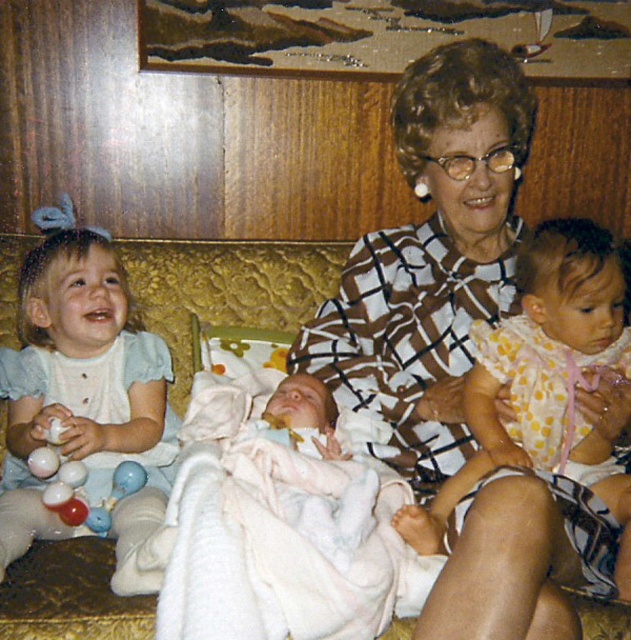
You are standing in the living room and see the light blue fabric dress at left. Can you reach out and touch it without moving your feet?

The light blue fabric dress at left is 3.71 feet away from the viewer, so you cannot reach it without moving your feet since the average human arm span is about 3 feet.

You are a photographer trying to capture a family photo. You notice two dresses in the scene, the light blue fabric dress at left and the yellow polka dot dress at center. Which dress is taller?

The light blue fabric dress at left is taller than the yellow polka dot dress at center.

You are a photographer setting up a camera to capture the scene. You need to ensure that both the light blue fabric dress at left and the yellow polka dot dress at center are in focus. The camera you are using has a depth of field that can cover 25 inches. Will both subjects be in focus?

The light blue fabric dress at left and the yellow polka dot dress at center are 26.49 inches apart from each other. Since the distance between them exceeds the camera depth of field of 25 inches, both subjects may not be in focus simultaneously.